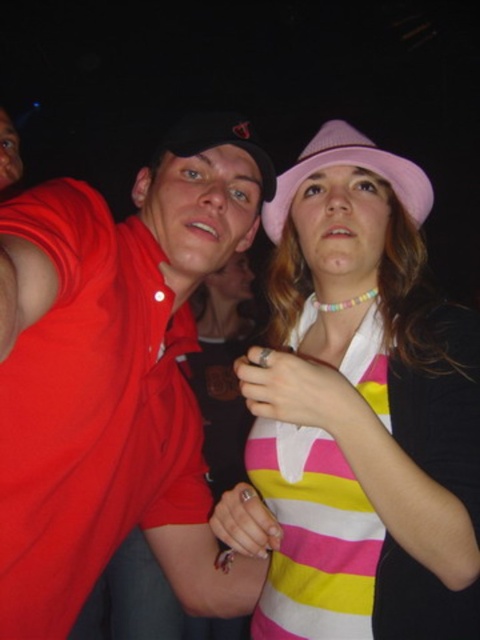
Is point (385, 298) closer to camera compared to point (425, 182)?

Yes, it is.

Is pink fabric hat at upper center further to the viewer compared to pink fabric baseball hat at upper center?

No, pink fabric hat at upper center is in front of pink fabric baseball hat at upper center.

What are the coordinates of `pink fabric hat at upper center` in the screenshot? It's located at (359, 413).

The width and height of the screenshot is (480, 640). I want to click on pink fabric hat at upper center, so click(x=359, y=413).

Who is more forward, (346, 592) or (183, 580)?

Positioned in front is point (346, 592).

This screenshot has height=640, width=480. I want to click on pink fabric hat at upper center, so click(359, 413).

Is matte red polo shirt at left to the right of pink fabric baseball hat at upper center from the viewer's perspective?

Incorrect, matte red polo shirt at left is not on the right side of pink fabric baseball hat at upper center.

Based on the photo, does matte red polo shirt at left have a larger size compared to pink fabric baseball hat at upper center?

Indeed, matte red polo shirt at left has a larger size compared to pink fabric baseball hat at upper center.

Is point (201, 205) closer to viewer compared to point (414, 214)?

That is True.

Locate an element on the screen. Image resolution: width=480 pixels, height=640 pixels. matte red polo shirt at left is located at coordinates (121, 364).